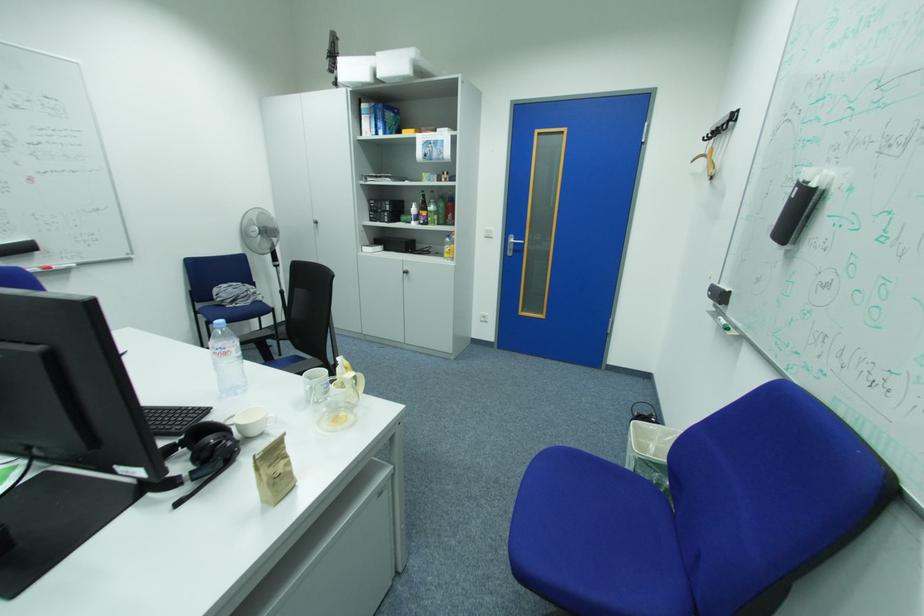
Where would you pull the tall cabinet handle? Please return your answer as a coordinate pair (x, y).

(383, 206)